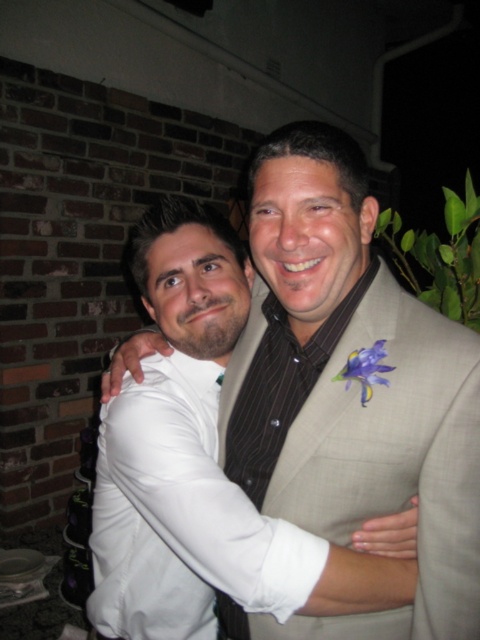
You are standing at the point marked as point (395,461) and want to greet someone who is 76.69 centimeters away from you. Can you reach out your hand to shake hands with them without moving from your current position?

Yes, because the distance between you and the person at point (395,461) is 76.69 centimeters, which is within a comfortable reach for a handshake.

You are a photographer adjusting your camera settings. You notice the white satin dress at center and the purple silk flower at center in the frame. Which object should you focus on first to ensure both are in sharp focus?

The white satin dress at center is closer to the viewer than the purple silk flower at center, so you should focus on the white satin dress at center first to ensure both are in sharp focus.